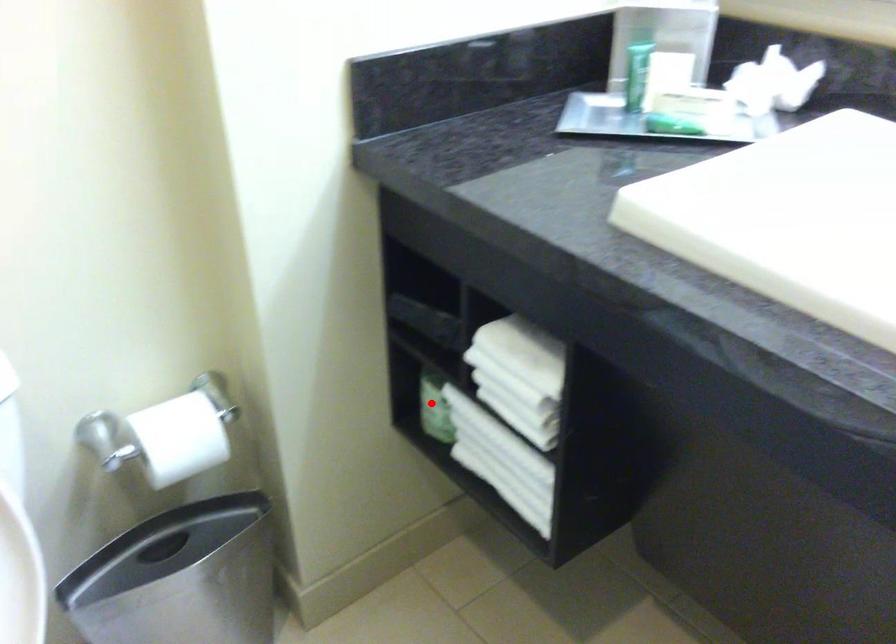
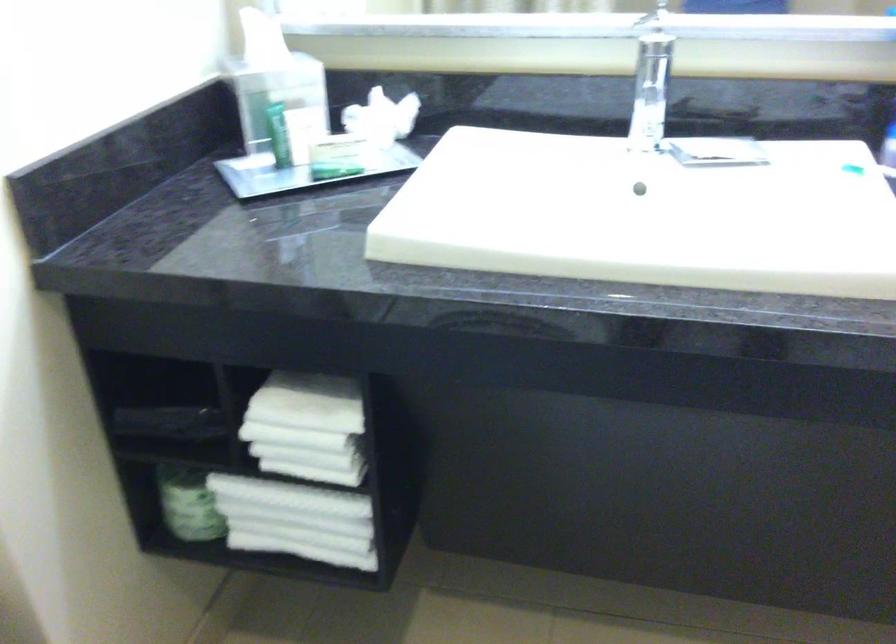
The point at the highlighted location is marked in the first image. Where is the corresponding point in the second image?

(188, 504)